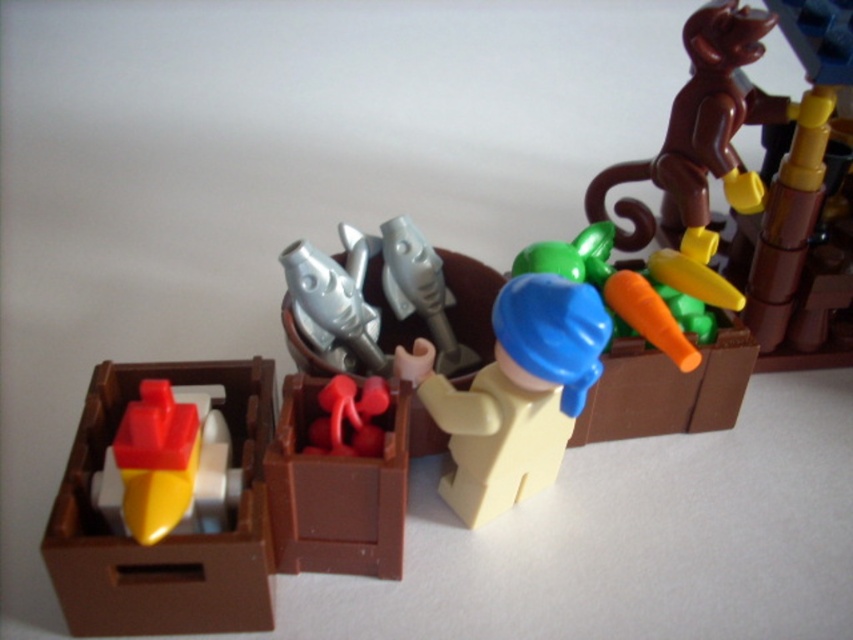
Question: Which object is the closest to the matte brown box at left?

Choices:
 (A) smooth plastic carrot at upper right
 (B) metallic silver rocket at center

Answer: (B)

Question: Considering the real-world distances, which object is farthest from the smooth plastic carrot at upper right?

Choices:
 (A) yellow matte figure at center
 (B) shiny plastic boat at left
 (C) rubberized red toy at center
 (D) matte brown box at left

Answer: (D)

Question: From the image, what is the correct spatial relationship of shiny plastic boat at left in relation to rubberized red toy at center?

Choices:
 (A) above
 (B) below

Answer: (B)

Question: In this image, where is brown matte box at center located relative to brown matte monkey at upper right?

Choices:
 (A) right
 (B) left

Answer: (B)

Question: Does matte brown box at left come in front of brown matte box at center?

Choices:
 (A) no
 (B) yes

Answer: (B)

Question: Which object is positioned farthest from the matte brown box at left?

Choices:
 (A) brown matte monkey at upper right
 (B) smooth plastic carrot at upper right
 (C) shiny plastic boat at left

Answer: (A)